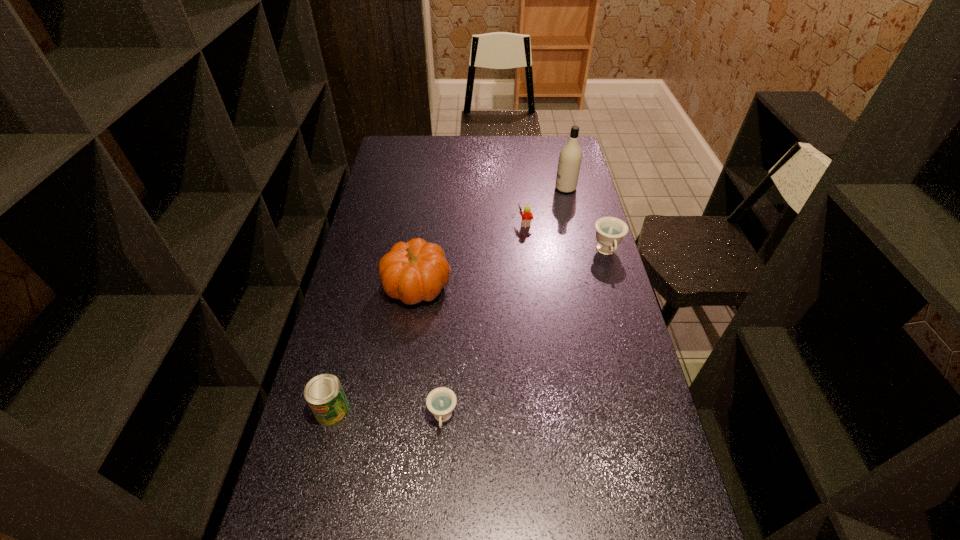
Identify the location of vacant area that lies between the right teacup and the leftmost object. (469, 331).

Identify which object is located as the fifth nearest to the fifth shortest object. Please provide its 2D coordinates. Your answer should be formatted as a tuple, i.e. [(x, y)], where the tuple contains the x and y coordinates of a point satisfying the conditions above.

[(570, 157)]

Identify the location of the closest object to the Lego. (570, 157).

This screenshot has height=540, width=960. In order to click on free space that satisfies the following two spatial constraints: 1. on the back side of the can; 2. on the right side of the fifth shortest object in this screenshot , I will do `click(364, 285)`.